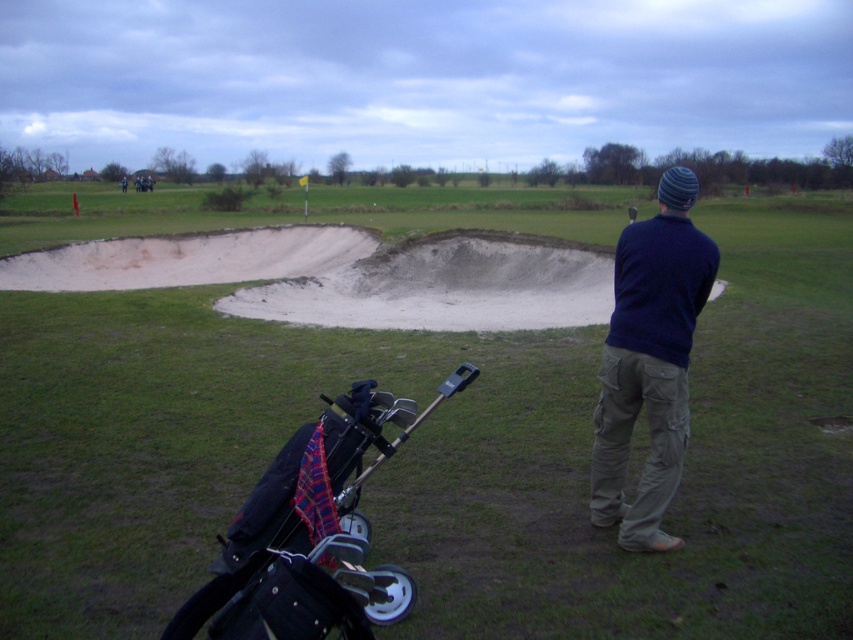
Can you confirm if sandymaterial/texturebunker at center is positioned above dark blue sweater at center?

Indeed, sandymaterial/texturebunker at center is positioned over dark blue sweater at center.

Which is more to the right, sandymaterial/texturebunker at center or dark blue sweater at center?

Positioned to the right is dark blue sweater at center.

Between point (228, 493) and point (683, 182), which one is positioned behind?

Positioned behind is point (228, 493).

Locate an element on the screen. sandymaterial/texturebunker at center is located at coordinates (442, 454).